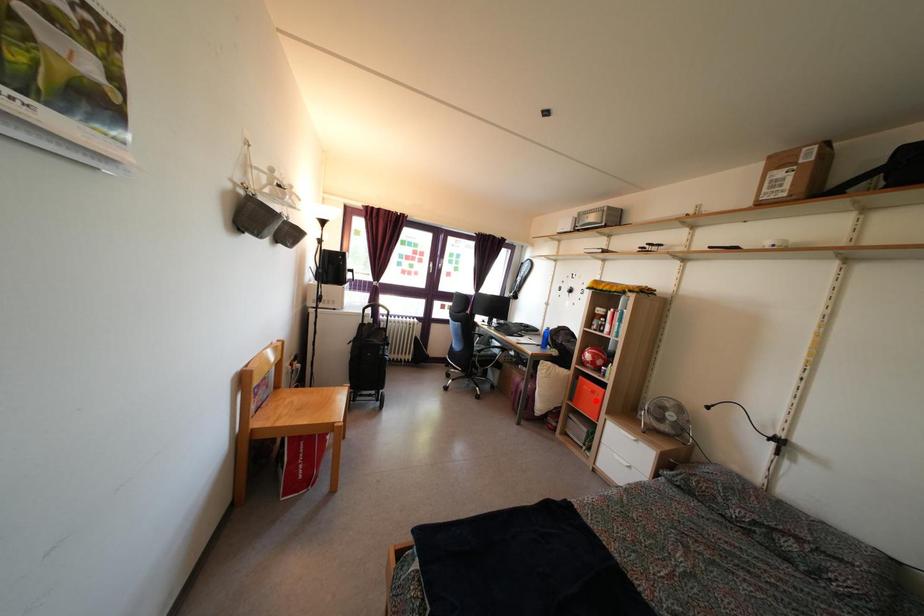
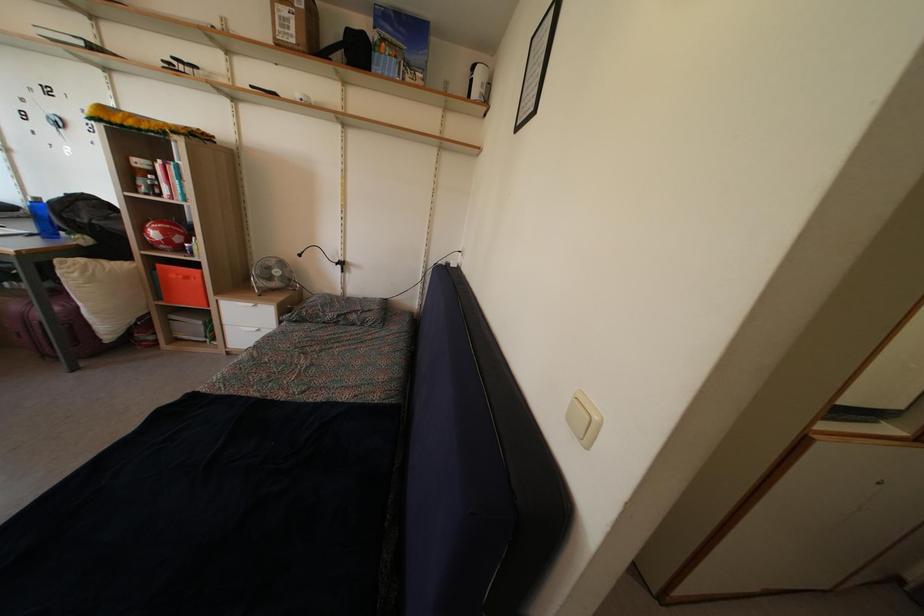
Locate, in the second image, the point that corresponds to the highlighted location in the first image.

(189, 286)